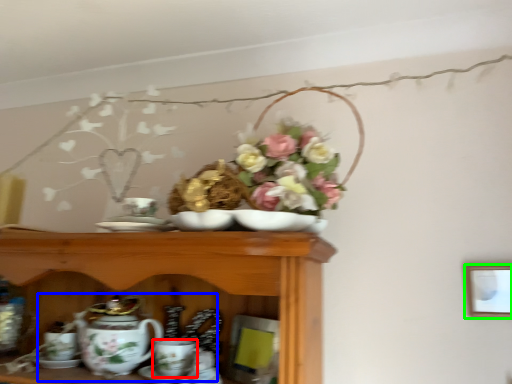
Question: Which object is positioned farthest from coffee cup (highlighted by a red box)? Select from tea set (highlighted by a blue box) and picture frame (highlighted by a green box).

Choices:
 (A) tea set
 (B) picture frame

Answer: (B)